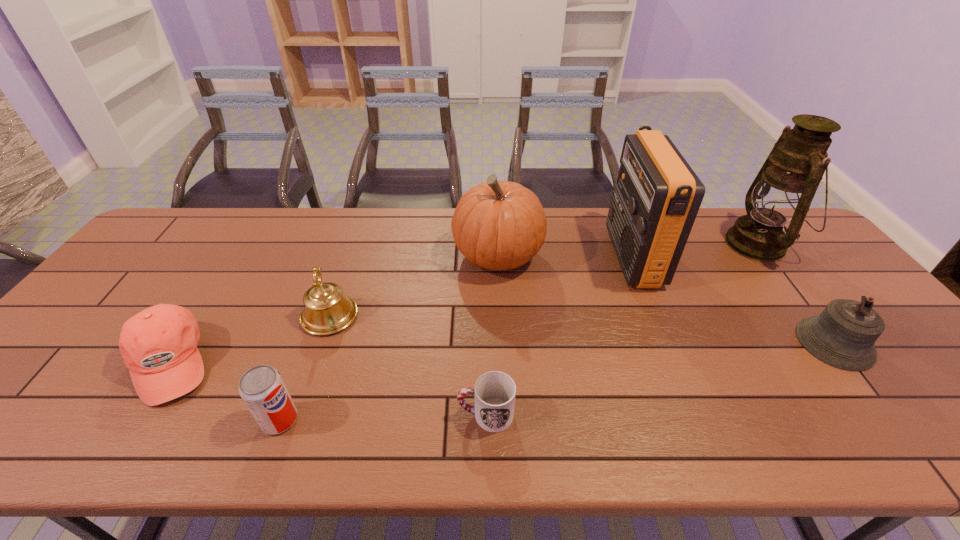
This screenshot has width=960, height=540. I want to click on free spot between the leftmost object and the soda, so pyautogui.click(x=225, y=391).

Find the location of a particular element. This screenshot has width=960, height=540. free space between the shortest object and the radio receiver is located at coordinates pos(560,335).

The image size is (960, 540). Find the location of `empty space between the third tallest object and the right bell`. empty space between the third tallest object and the right bell is located at coordinates (666, 299).

Identify the location of free space between the left bell and the baseball cap. (250, 339).

Find the location of `free space between the baseball cap and the soda`. free space between the baseball cap and the soda is located at coordinates point(225,391).

Identify which object is located as the sixth nearest to the cup. Please provide its 2D coordinates. Your answer should be formatted as a tuple, i.e. [(x, y)], where the tuple contains the x and y coordinates of a point satisfying the conditions above.

[(843, 335)]

I want to click on object that is the seventh closest one to the sixth shortest object, so click(843, 335).

Locate an element on the screen. vacant position in the image that satisfies the following two spatial constraints: 1. on the side of the right bell where the handle is located; 2. on the right side of the shortest object is located at coordinates (485, 343).

Find the location of a particular element. Image resolution: width=960 pixels, height=540 pixels. free space that satisfies the following two spatial constraints: 1. on the back side of the right bell; 2. on the front-facing side of the second tallest object is located at coordinates (769, 256).

I want to click on vacant space that satisfies the following two spatial constraints: 1. on the side of the tallest object where the handle is located; 2. on the left side of the cup, so click(484, 244).